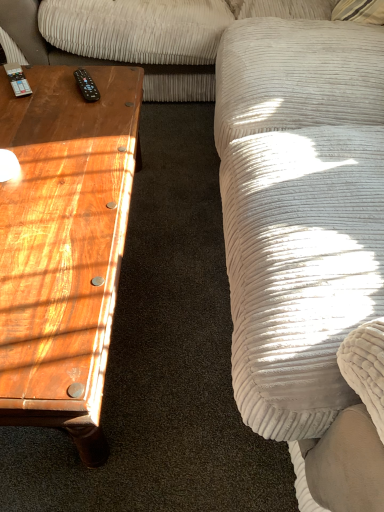
This screenshot has height=512, width=384. What are the coordinates of `vacant space behind black plastic remote at upper left` in the screenshot? It's located at (99, 74).